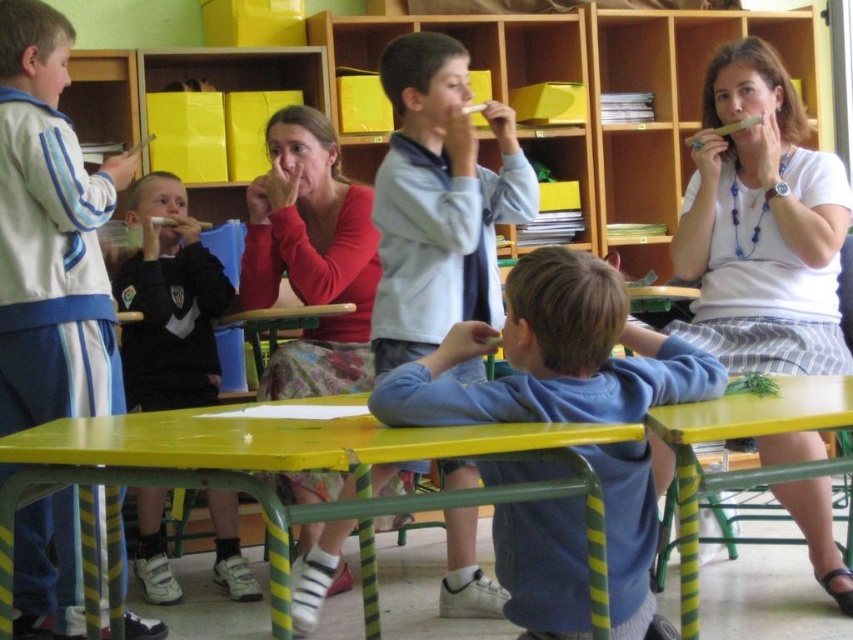
Question: Among these objects, which one is nearest to the camera?

Choices:
 (A) blue fleece sweater at center
 (B) yellow plastic table at lower right
 (C) light blue fleece jacket at center

Answer: (B)

Question: Can you confirm if blue fleece sweater at center is positioned above light blue track suit at left?

Choices:
 (A) yes
 (B) no

Answer: (B)

Question: Which point is farther to the camera?

Choices:
 (A) (519, 305)
 (B) (511, 145)
 (C) (781, 385)
 (D) (778, 227)

Answer: (D)

Question: Does matte red sweater at center appear under yellow plastic table at lower right?

Choices:
 (A) no
 (B) yes

Answer: (A)

Question: Which object is positioned farthest from the white matte shirt at upper right?

Choices:
 (A) yellow painted wood table at lower center
 (B) black jersey at left
 (C) light blue track suit at left
 (D) blue fleece sweater at center

Answer: (C)

Question: In this image, where is white matte shirt at upper right located relative to black jersey at left?

Choices:
 (A) right
 (B) left

Answer: (A)